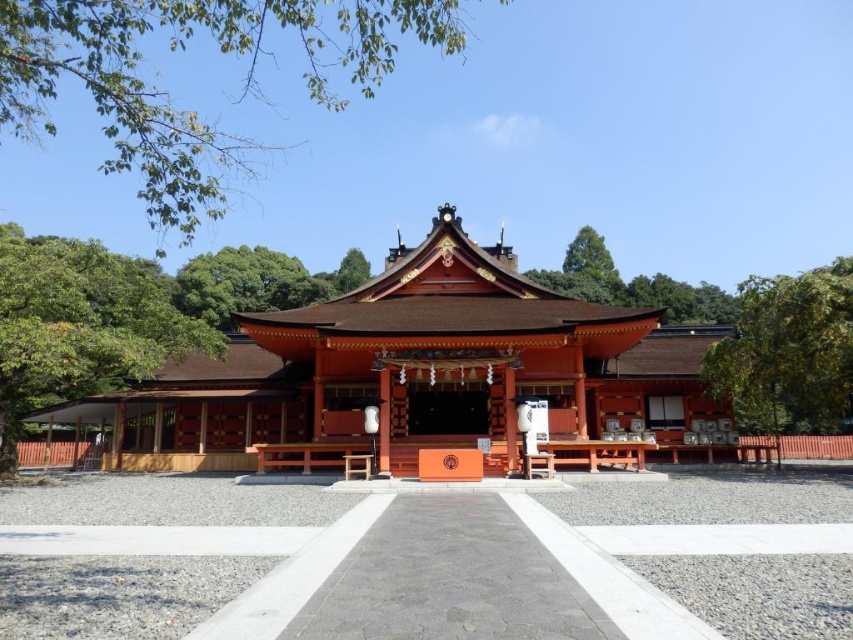
Who is shorter, green leafy tree at upper center or green leafy tree at left?

green leafy tree at left is shorter.

Does green leafy tree at upper center have a lesser width compared to green leafy tree at left?

No.

At what (x,y) coordinates should I click in order to perform the action: click on green leafy tree at upper center. Please return your answer as a coordinate pair (x, y). Image resolution: width=853 pixels, height=640 pixels. Looking at the image, I should click on (183, 49).

Is shiny red wood shrine at center closer to camera compared to green leafy tree at upper center?

That is False.

Who is lower down, shiny red wood shrine at center or green leafy tree at upper center?

shiny red wood shrine at center

At what (x,y) coordinates should I click in order to perform the action: click on shiny red wood shrine at center. Please return your answer as a coordinate pair (x, y). Looking at the image, I should click on (421, 376).

Find the location of `shiny red wood shrine at center`. shiny red wood shrine at center is located at coordinates (421, 376).

Locate an element on the screen. shiny red wood shrine at center is located at coordinates (421, 376).

Does shiny red wood shrine at center come in front of green leafy tree at right?

No, shiny red wood shrine at center is behind green leafy tree at right.

Is point (396, 337) closer to viewer compared to point (807, 419)?

Yes, point (396, 337) is in front of point (807, 419).

Find the location of a particular element. This screenshot has height=640, width=853. shiny red wood shrine at center is located at coordinates (421, 376).